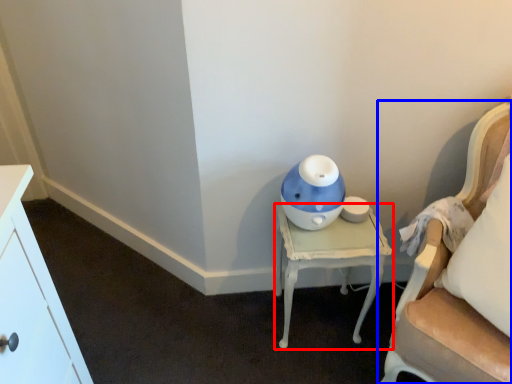
Question: Which point is further to the camera, nightstand (highlighted by a red box) or chair (highlighted by a blue box)?

Choices:
 (A) nightstand
 (B) chair

Answer: (A)